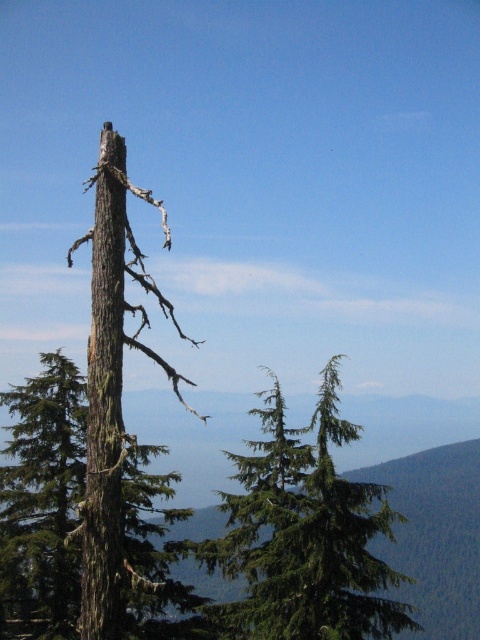
Is green needle-like tree at center wider than brown rough bark tree at center?

Indeed, green needle-like tree at center has a greater width compared to brown rough bark tree at center.

Based on the photo, can you confirm if green needle-like tree at center is smaller than brown rough bark tree at center?

Yes.

Is point (346, 493) in front of point (61, 604)?

That is True.

I want to click on green needle-like tree at center, so click(x=303, y=536).

Can you confirm if green needle-like tree at center is shorter than brown rough bark tree at left?

Correct, green needle-like tree at center is not as tall as brown rough bark tree at left.

Does green needle-like tree at center have a smaller size compared to brown rough bark tree at left?

No, green needle-like tree at center is not smaller than brown rough bark tree at left.

Does point (302, 609) come closer to viewer compared to point (107, 288)?

No, (302, 609) is further to viewer.

Where is `green needle-like tree at center`? This screenshot has width=480, height=640. green needle-like tree at center is located at coordinates (303, 536).

Who is lower down, brown rough bark tree at center or brown rough bark tree trunk at left?

Positioned lower is brown rough bark tree at center.

Is brown rough bark tree at center smaller than brown rough bark tree trunk at left?

No.

Is point (40, 496) positioned behind point (120, 499)?

Yes, it is.

Identify the location of brown rough bark tree at center. This screenshot has height=640, width=480. pos(43,502).